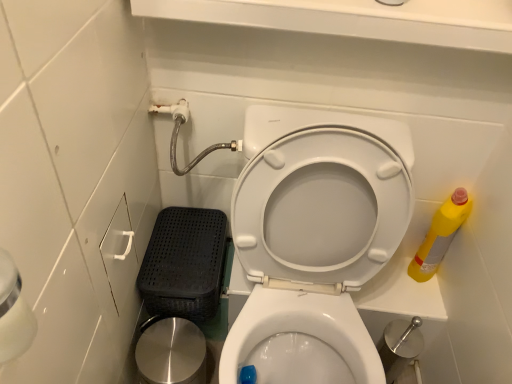
Question: Is white glossy toilet seat at center turned away from polished stainless steel potty at lower left?

Choices:
 (A) no
 (B) yes

Answer: (A)

Question: From the image's perspective, does white glossy toilet seat at center appear lower than polished stainless steel potty at lower left?

Choices:
 (A) yes
 (B) no

Answer: (B)

Question: Does white glossy toilet seat at center appear on the left side of polished stainless steel potty at lower left?

Choices:
 (A) no
 (B) yes

Answer: (A)

Question: Is white glossy toilet seat at center positioned before polished stainless steel potty at lower left?

Choices:
 (A) no
 (B) yes

Answer: (B)

Question: Does white glossy toilet seat at center have a lesser height compared to polished stainless steel potty at lower left?

Choices:
 (A) no
 (B) yes

Answer: (A)

Question: Which is correct: yellow plastic bottle at right is inside polished stainless steel potty at lower left, or outside of it?

Choices:
 (A) inside
 (B) outside

Answer: (B)

Question: From a real-world perspective, is yellow plastic bottle at right above or below polished stainless steel potty at lower left?

Choices:
 (A) above
 (B) below

Answer: (A)

Question: Is yellow plastic bottle at right bigger or smaller than polished stainless steel potty at lower left?

Choices:
 (A) small
 (B) big

Answer: (A)

Question: Based on their positions, is yellow plastic bottle at right located to the left or right of polished stainless steel potty at lower left?

Choices:
 (A) right
 (B) left

Answer: (A)

Question: Is white glossy toilet seat at center to the left or to the right of yellow plastic bottle at right in the image?

Choices:
 (A) left
 (B) right

Answer: (A)

Question: Considering the positions of white glossy toilet seat at center and yellow plastic bottle at right in the image, is white glossy toilet seat at center bigger or smaller than yellow plastic bottle at right?

Choices:
 (A) big
 (B) small

Answer: (A)

Question: From a real-world perspective, is white glossy toilet seat at center above or below yellow plastic bottle at right?

Choices:
 (A) above
 (B) below

Answer: (B)

Question: Does point (x=357, y=281) appear closer or farther from the camera than point (x=444, y=201)?

Choices:
 (A) closer
 (B) farther

Answer: (A)

Question: Considering the positions of polished stainless steel potty at lower left and yellow plastic bottle at right in the image, is polished stainless steel potty at lower left taller or shorter than yellow plastic bottle at right?

Choices:
 (A) short
 (B) tall

Answer: (A)

Question: Considering their positions, is polished stainless steel potty at lower left located in front of or behind yellow plastic bottle at right?

Choices:
 (A) behind
 (B) front

Answer: (B)